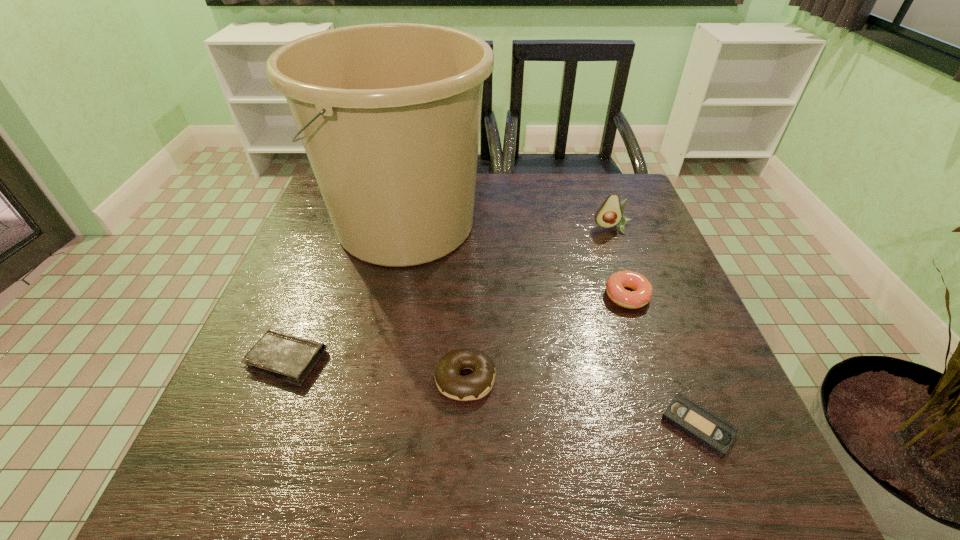
Find the location of a particular element. The width and height of the screenshot is (960, 540). object located at the near right corner is located at coordinates (708, 429).

Locate an element on the screen. free space at the far edge of the desktop is located at coordinates (523, 184).

In the image, there is a desktop. Where is `vacant space at the near edge`? vacant space at the near edge is located at coordinates [628, 462].

Find the location of a particular element. Image resolution: width=960 pixels, height=540 pixels. free location at the left edge of the desktop is located at coordinates click(x=324, y=297).

Where is `vacant region at the far right corner of the desktop`? This screenshot has width=960, height=540. vacant region at the far right corner of the desktop is located at coordinates (629, 218).

Image resolution: width=960 pixels, height=540 pixels. In order to click on free space between the tallest object and the diary in this screenshot , I will do `click(347, 292)`.

Find the location of `vacant space that is in between the right doughnut and the videotape`. vacant space that is in between the right doughnut and the videotape is located at coordinates (662, 361).

Identify the location of free space between the avocado and the videotape. (656, 327).

The height and width of the screenshot is (540, 960). I want to click on empty space between the shortest object and the left doughnut, so tap(582, 402).

You are a GUI agent. You are given a task and a screenshot of the screen. Output one action in this format:
    pyautogui.click(x=<x>, y=<y>)
    Task: Click on the vacant space in between the right doughnut and the fifth shortest object
    The height and width of the screenshot is (540, 960).
    Given the screenshot: What is the action you would take?
    pyautogui.click(x=620, y=262)